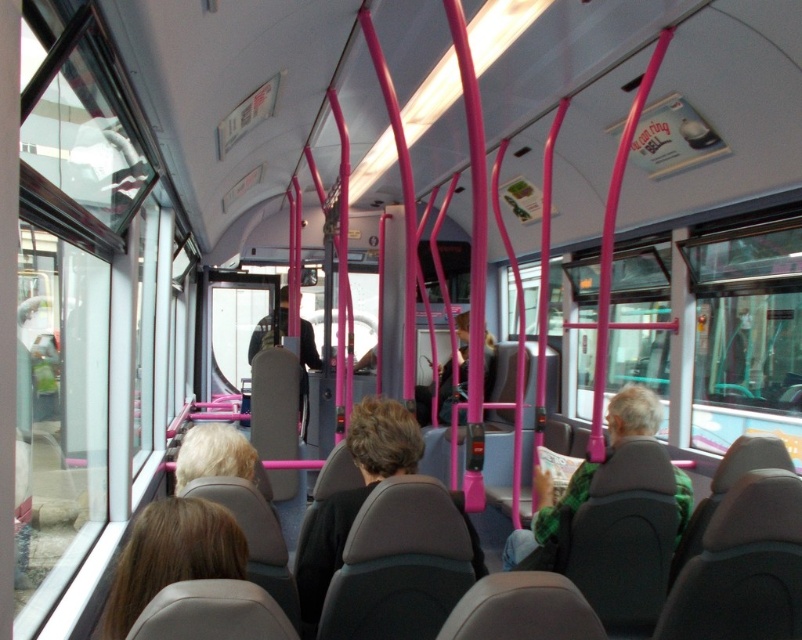
You are a passenger on a public bus and notice a person with blonde hair at lower left. If you want to ask them a question, can you comfortably approach them without moving more than 4 feet from your current position?

The blonde hair at lower left and viewer are 4.29 feet apart from each other. Since the distance is slightly more than 4 feet, you cannot comfortably approach them without moving more than 4 feet from your current position.

You are a passenger on a public bus and notice two items in the scene. One is the blonde hair at lower left and the other is the green plaid shirt at center. Which of these two items appears narrower?

The blonde hair at lower left has a lesser width compared to the green plaid shirt at center, so the blonde hair at lower left appears narrower.